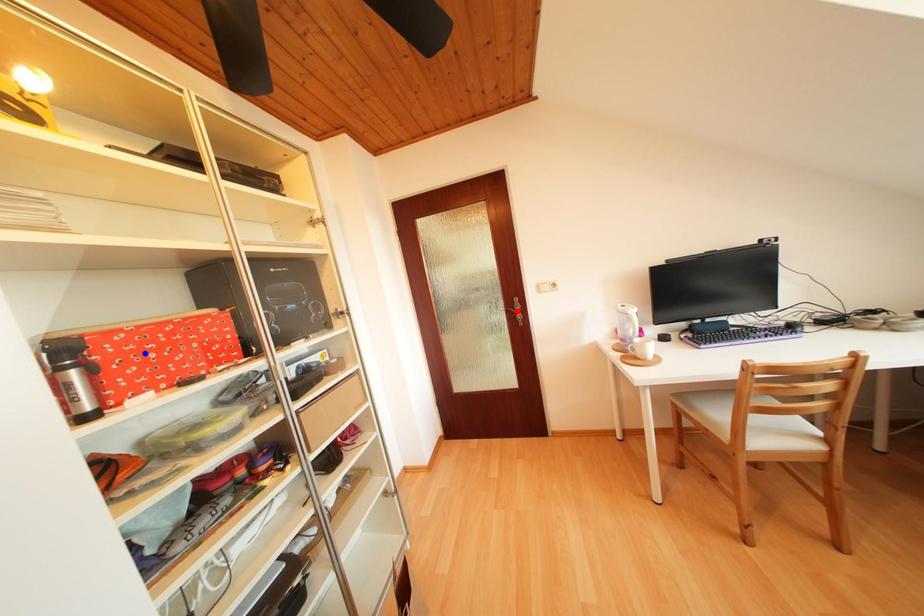
Question: Which of the two points in the image is closer to the camera?

Choices:
 (A) Blue point is closer.
 (B) Red point is closer.

Answer: (A)